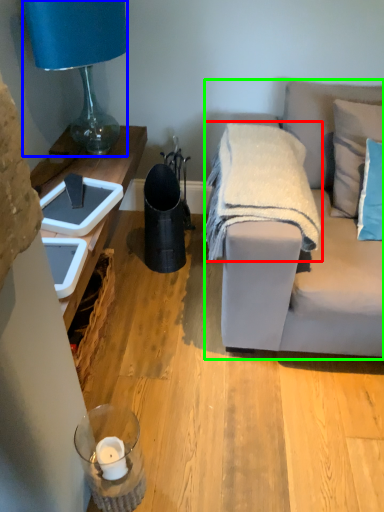
Question: Which is nearer to the blanket (highlighted by a red box)? lamp (highlighted by a blue box) or studio couch (highlighted by a green box).

Choices:
 (A) lamp
 (B) studio couch

Answer: (B)